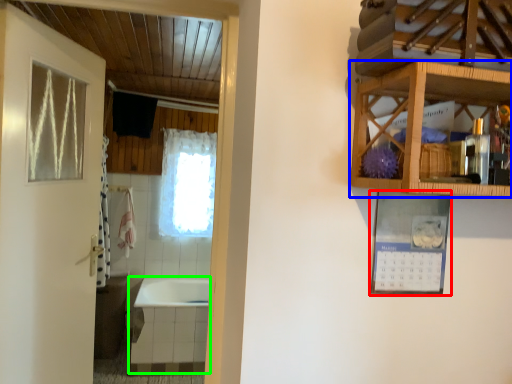
Question: Which object is positioned farthest from picture frame (highlighted by a red box)? Select from cabinetry (highlighted by a blue box) and bath (highlighted by a green box).

Choices:
 (A) cabinetry
 (B) bath

Answer: (B)